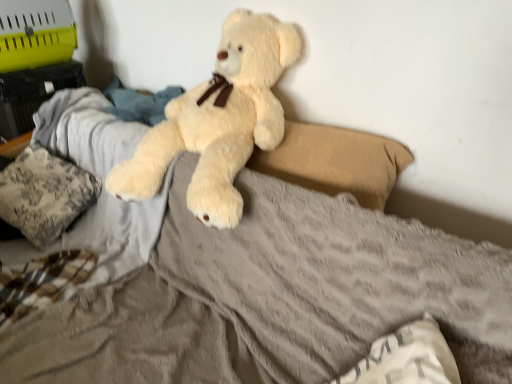
The width and height of the screenshot is (512, 384). Find the location of `fluffy fabric pillow at left, which ranks as the first pillow in left-to-right order`. fluffy fabric pillow at left, which ranks as the first pillow in left-to-right order is located at coordinates (44, 194).

What do you see at coordinates (407, 358) in the screenshot?
I see `white soft pillow at lower right, arranged as the 3th pillow when viewed from the left` at bounding box center [407, 358].

Where is `beige fabric pillow at center, which appears as the second pillow when viewed from the right`? This screenshot has width=512, height=384. beige fabric pillow at center, which appears as the second pillow when viewed from the right is located at coordinates (336, 161).

You are a GUI agent. You are given a task and a screenshot of the screen. Output one action in this format:
    pyautogui.click(x=<x>, y=<y>)
    Task: Click on the fluffy beige teddy bear at center
    The width and height of the screenshot is (512, 384).
    Given the screenshot: What is the action you would take?
    pyautogui.click(x=218, y=121)

Can we say white soft pillow at lower right, which is the 1th pillow in right-to-left order, lies outside fluffy fabric pillow at left, acting as the third pillow starting from the front?

Yes.

Is white soft pillow at lower right, the 3th pillow when ordered from back to front, facing towards fluffy fabric pillow at left, which ranks as the first pillow in left-to-right order?

No, white soft pillow at lower right, the 3th pillow when ordered from back to front, is not oriented towards fluffy fabric pillow at left, which ranks as the first pillow in left-to-right order.

From the image's perspective, which is above, white soft pillow at lower right, the 3th pillow when ordered from back to front, or fluffy fabric pillow at left, acting as the third pillow starting from the front?

fluffy fabric pillow at left, acting as the third pillow starting from the front, from the image's perspective.

Is white soft pillow at lower right, the 3th pillow when ordered from back to front, smaller than fluffy fabric pillow at left, which ranks as the first pillow in left-to-right order?

Yes, white soft pillow at lower right, the 3th pillow when ordered from back to front, is smaller than fluffy fabric pillow at left, which ranks as the first pillow in left-to-right order.

From a real-world perspective, is fluffy beige teddy bear at center located beneath fluffy fabric pillow at left, acting as the third pillow starting from the front?

No.

Is fluffy beige teddy bear at center positioned far away from fluffy fabric pillow at left, which appears as the 3th pillow when viewed from the right?

That's not correct — fluffy beige teddy bear at center is a little close to fluffy fabric pillow at left, which appears as the 3th pillow when viewed from the right.

From the image's perspective, which object appears higher, fluffy beige teddy bear at center or fluffy fabric pillow at left, which ranks as the first pillow in left-to-right order?

fluffy beige teddy bear at center, from the image's perspective.

Is point (164, 163) closer or farther from the camera than point (66, 187)?

Point (164, 163) is positioned closer to the camera compared to point (66, 187).

Could you measure the distance between beige fabric pillow at center, the second pillow when ordered from back to front, and white soft pillow at lower right, the 3th pillow when ordered from back to front?

They are 50.44 centimeters apart.

From the image's perspective, would you say beige fabric pillow at center, the second pillow when ordered from back to front, is shown under white soft pillow at lower right, arranged as the 3th pillow when viewed from the left?

Actually, beige fabric pillow at center, the second pillow when ordered from back to front, appears above white soft pillow at lower right, arranged as the 3th pillow when viewed from the left, in the image.

Does beige fabric pillow at center, which appears as the second pillow when viewed from the right, come behind white soft pillow at lower right, which is the 1th pillow in right-to-left order?

Yes.

How different are the orientations of beige fabric pillow at center, the second pillow when ordered from back to front, and white soft pillow at lower right, which is the 1th pillow from front to back, in degrees?

beige fabric pillow at center, the second pillow when ordered from back to front, and white soft pillow at lower right, which is the 1th pillow from front to back, are facing 52.5 degrees away from each other.

You are a GUI agent. You are given a task and a screenshot of the screen. Output one action in this format:
    pyautogui.click(x=<x>, y=<y>)
    Task: Click on the pillow that is the 1st one when counting forward from the fluffy fabric pillow at left, acting as the 1th pillow starting from the back
    The height and width of the screenshot is (384, 512).
    Given the screenshot: What is the action you would take?
    pyautogui.click(x=336, y=161)

Considering the relative sizes of beige fabric pillow at center, which appears as the second pillow when viewed from the right, and fluffy fabric pillow at left, acting as the 1th pillow starting from the back, in the image provided, is beige fabric pillow at center, which appears as the second pillow when viewed from the right, wider than fluffy fabric pillow at left, acting as the 1th pillow starting from the back,?

Incorrect, the width of beige fabric pillow at center, which appears as the second pillow when viewed from the right, does not surpass that of fluffy fabric pillow at left, acting as the 1th pillow starting from the back.

Measure the distance from beige fabric pillow at center, which appears as the second pillow when viewed from the right, to fluffy fabric pillow at left, acting as the third pillow starting from the front.

They are 35.94 inches apart.

Is point (296, 160) farther from viewer compared to point (7, 169)?

No, (296, 160) is closer to viewer.

From a real-world perspective, is white soft pillow at lower right, the 3th pillow when ordered from back to front, under fluffy beige teddy bear at center?

Yes.

Is white soft pillow at lower right, arranged as the 3th pillow when viewed from the left, at the right side of fluffy beige teddy bear at center?

Yes, white soft pillow at lower right, arranged as the 3th pillow when viewed from the left, is to the right of fluffy beige teddy bear at center.

Does white soft pillow at lower right, which is the 1th pillow in right-to-left order, lie in front of fluffy beige teddy bear at center?

Yes, white soft pillow at lower right, which is the 1th pillow in right-to-left order, is closer to the camera.

Which of these two, white soft pillow at lower right, the 3th pillow when ordered from back to front, or fluffy beige teddy bear at center, is thinner?

white soft pillow at lower right, the 3th pillow when ordered from back to front, is thinner.

Considering the sizes of fluffy fabric pillow at left, which ranks as the first pillow in left-to-right order, and white soft pillow at lower right, which is the 1th pillow in right-to-left order, in the image, is fluffy fabric pillow at left, which ranks as the first pillow in left-to-right order, taller or shorter than white soft pillow at lower right, which is the 1th pillow in right-to-left order,?

Considering their sizes, fluffy fabric pillow at left, which ranks as the first pillow in left-to-right order, has more height than white soft pillow at lower right, which is the 1th pillow in right-to-left order.

Consider the image. Between fluffy fabric pillow at left, acting as the third pillow starting from the front, and white soft pillow at lower right, which is the 1th pillow in right-to-left order, which one has larger width?

fluffy fabric pillow at left, acting as the third pillow starting from the front, is wider.

From the image's perspective, between fluffy fabric pillow at left, acting as the 1th pillow starting from the back, and white soft pillow at lower right, arranged as the 3th pillow when viewed from the left, who is located below?

white soft pillow at lower right, arranged as the 3th pillow when viewed from the left, appears lower in the image.

Between fluffy fabric pillow at left, acting as the third pillow starting from the front, and white soft pillow at lower right, which is the 1th pillow from front to back, which one has smaller size?

white soft pillow at lower right, which is the 1th pillow from front to back, is smaller.

This screenshot has width=512, height=384. Identify the location of teddy bear above the white soft pillow at lower right, which is the 1th pillow from front to back (from a real-world perspective). (218, 121).

Who is shorter, fluffy beige teddy bear at center or white soft pillow at lower right, arranged as the 3th pillow when viewed from the left?

white soft pillow at lower right, arranged as the 3th pillow when viewed from the left.

Consider the image. Which object is thinner, fluffy beige teddy bear at center or white soft pillow at lower right, which is the 1th pillow in right-to-left order?

With smaller width is white soft pillow at lower right, which is the 1th pillow in right-to-left order.

Consider the image. Which of these two, fluffy beige teddy bear at center or white soft pillow at lower right, the 3th pillow when ordered from back to front, is bigger?

Bigger between the two is fluffy beige teddy bear at center.

Where is `pillow beneath the fluffy fabric pillow at left, acting as the 1th pillow starting from the back (from a real-world perspective)`? pillow beneath the fluffy fabric pillow at left, acting as the 1th pillow starting from the back (from a real-world perspective) is located at coordinates (407, 358).

At what (x,y) coordinates should I click in order to perform the action: click on teddy bear in front of the fluffy fabric pillow at left, which appears as the 3th pillow when viewed from the right. Please return your answer as a coordinate pair (x, y). This screenshot has height=384, width=512. Looking at the image, I should click on (218, 121).

From the image, which object appears to be farther from fluffy fabric pillow at left, which appears as the 3th pillow when viewed from the right, white soft pillow at lower right, arranged as the 3th pillow when viewed from the left, or fluffy beige teddy bear at center?

white soft pillow at lower right, arranged as the 3th pillow when viewed from the left.

Which object lies nearer to the anchor point fluffy beige teddy bear at center, white soft pillow at lower right, which is the 1th pillow in right-to-left order, or beige fabric pillow at center, the 2th pillow in the left-to-right sequence?

The object closer to fluffy beige teddy bear at center is beige fabric pillow at center, the 2th pillow in the left-to-right sequence.

Estimate the real-world distances between objects in this image. Which object is further from white soft pillow at lower right, which is the 1th pillow in right-to-left order, fluffy fabric pillow at left, which ranks as the first pillow in left-to-right order, or fluffy beige teddy bear at center?

Among the two, fluffy fabric pillow at left, which ranks as the first pillow in left-to-right order, is located further to white soft pillow at lower right, which is the 1th pillow in right-to-left order.

When comparing their distances from white soft pillow at lower right, arranged as the 3th pillow when viewed from the left, does beige fabric pillow at center, the second pillow when ordered from back to front, or fluffy fabric pillow at left, which ranks as the first pillow in left-to-right order, seem closer?

beige fabric pillow at center, the second pillow when ordered from back to front, lies closer to white soft pillow at lower right, arranged as the 3th pillow when viewed from the left, than the other object.

Considering their positions, is fluffy fabric pillow at left, which appears as the 3th pillow when viewed from the right, positioned further to white soft pillow at lower right, arranged as the 3th pillow when viewed from the left, than beige fabric pillow at center, the 2th pillow in the left-to-right sequence?

The object further to white soft pillow at lower right, arranged as the 3th pillow when viewed from the left, is fluffy fabric pillow at left, which appears as the 3th pillow when viewed from the right.

Looking at the image, which one is located further to beige fabric pillow at center, which appears as the second pillow when viewed from the right, white soft pillow at lower right, the 3th pillow when ordered from back to front, or fluffy fabric pillow at left, which ranks as the first pillow in left-to-right order?

fluffy fabric pillow at left, which ranks as the first pillow in left-to-right order, lies further to beige fabric pillow at center, which appears as the second pillow when viewed from the right, than the other object.

Which object lies nearer to the anchor point fluffy beige teddy bear at center, fluffy fabric pillow at left, which appears as the 3th pillow when viewed from the right, or white soft pillow at lower right, the 3th pillow when ordered from back to front?

fluffy fabric pillow at left, which appears as the 3th pillow when viewed from the right, is positioned closer to the anchor fluffy beige teddy bear at center.

Estimate the real-world distances between objects in this image. Which object is closer to fluffy beige teddy bear at center, beige fabric pillow at center, the second pillow when ordered from back to front, or white soft pillow at lower right, the 3th pillow when ordered from back to front?

beige fabric pillow at center, the second pillow when ordered from back to front, is closer to fluffy beige teddy bear at center.

This screenshot has width=512, height=384. What are the coordinates of `teddy bear between fluffy fabric pillow at left, which appears as the 3th pillow when viewed from the right, and beige fabric pillow at center, the 2th pillow in the left-to-right sequence, from left to right` in the screenshot? It's located at [x=218, y=121].

Identify the location of pillow located between fluffy fabric pillow at left, which ranks as the first pillow in left-to-right order, and white soft pillow at lower right, the 3th pillow when ordered from back to front, in the left-right direction. (336, 161).

The width and height of the screenshot is (512, 384). What are the coordinates of `teddy bear between fluffy fabric pillow at left, acting as the third pillow starting from the front, and white soft pillow at lower right, the 3th pillow when ordered from back to front, from left to right` in the screenshot? It's located at (218, 121).